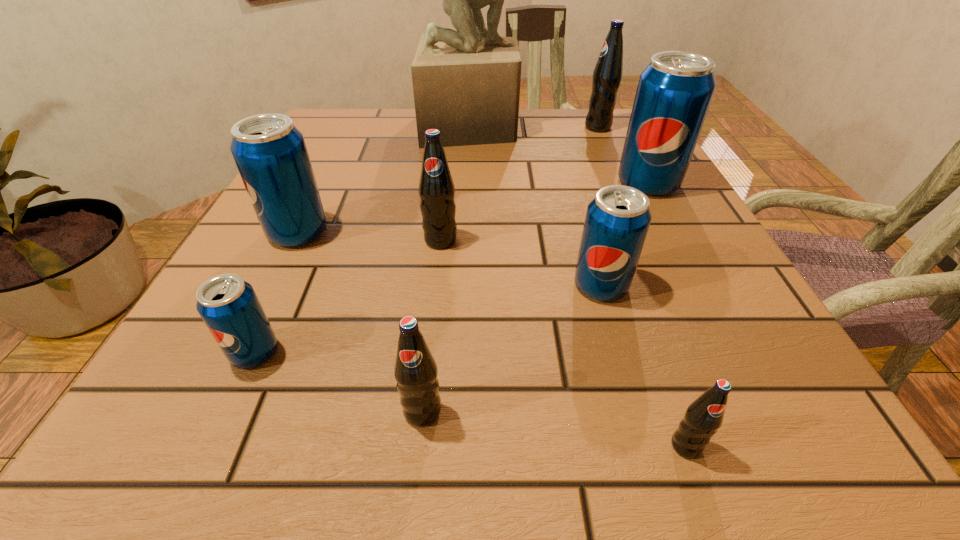
Find the location of a particular element. This screenshot has width=960, height=540. the second smallest black pop is located at coordinates (415, 370).

Where is `the third farthest black pop`? This screenshot has height=540, width=960. the third farthest black pop is located at coordinates (415, 370).

Find the location of a particular element. The width and height of the screenshot is (960, 540). the third nearest object is located at coordinates (228, 305).

Identify the location of the smallest blue pop soda. (228, 305).

I want to click on the nearest pop, so click(704, 416).

Where is `the nearest object`? The height and width of the screenshot is (540, 960). the nearest object is located at coordinates coord(704,416).

At what (x,y) coordinates should I click in order to perform the action: click on vacant position located on the front-facing side of the tallest object. Please return your answer as a coordinate pair (x, y). The image size is (960, 540). Looking at the image, I should click on (561, 127).

I want to click on vacant region located 0.310m on the front of the farthest blue pop soda, so click(722, 323).

The height and width of the screenshot is (540, 960). What are the coordinates of `vacant area situated 0.080m on the front label of the biggest black pop` in the screenshot? It's located at (552, 127).

Locate an element on the screen. vacant space located 0.330m on the front label of the biggest black pop is located at coordinates point(448,127).